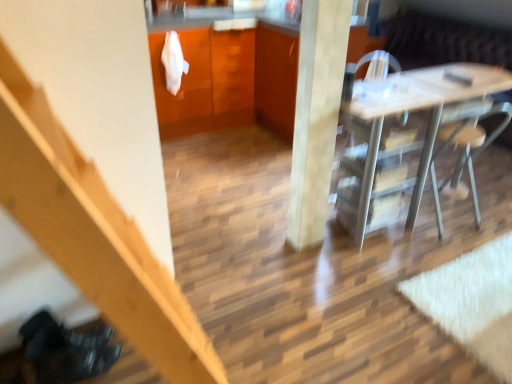
Find the location of a particular element. This screenshot has height=384, width=512. vacant space to the left of smooth light wood pillar at center is located at coordinates (274, 249).